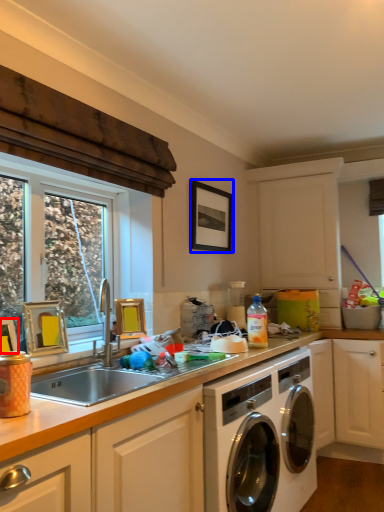
Question: Which object appears farthest to the camera in this image, picture frame (highlighted by a red box) or picture frame (highlighted by a blue box)?

Choices:
 (A) picture frame
 (B) picture frame

Answer: (B)